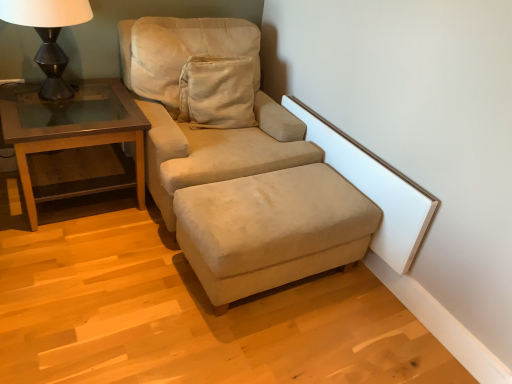
Question: Are beige suede ottoman at lower center and matte black lamp at left located far from each other?

Choices:
 (A) no
 (B) yes

Answer: (B)

Question: From a real-world perspective, is beige suede ottoman at lower center beneath matte black lamp at left?

Choices:
 (A) no
 (B) yes

Answer: (B)

Question: From the image's perspective, is beige suede ottoman at lower center below matte black lamp at left?

Choices:
 (A) no
 (B) yes

Answer: (B)

Question: Can you confirm if beige suede ottoman at lower center is positioned to the right of matte black lamp at left?

Choices:
 (A) no
 (B) yes

Answer: (B)

Question: Is beige suede ottoman at lower center further to camera compared to matte black lamp at left?

Choices:
 (A) no
 (B) yes

Answer: (A)

Question: From the image's perspective, would you say beige suede ottoman at lower center is positioned over matte black lamp at left?

Choices:
 (A) no
 (B) yes

Answer: (A)

Question: Is beige suede ottoman at lower center turned away from brown wood/glass table at left?

Choices:
 (A) yes
 (B) no

Answer: (A)

Question: From the image's perspective, is beige suede ottoman at lower center beneath brown wood/glass table at left?

Choices:
 (A) no
 (B) yes

Answer: (B)

Question: From a real-world perspective, is beige suede ottoman at lower center positioned over brown wood/glass table at left based on gravity?

Choices:
 (A) no
 (B) yes

Answer: (A)

Question: Is beige suede ottoman at lower center far from brown wood/glass table at left?

Choices:
 (A) no
 (B) yes

Answer: (A)

Question: Can you confirm if beige suede ottoman at lower center is smaller than brown wood/glass table at left?

Choices:
 (A) yes
 (B) no

Answer: (A)

Question: Considering the relative sizes of beige suede ottoman at lower center and brown wood/glass table at left in the image provided, is beige suede ottoman at lower center shorter than brown wood/glass table at left?

Choices:
 (A) yes
 (B) no

Answer: (A)

Question: From the image's perspective, would you say suede beige studio couch at center is positioned over matte black lamp at left?

Choices:
 (A) yes
 (B) no

Answer: (B)